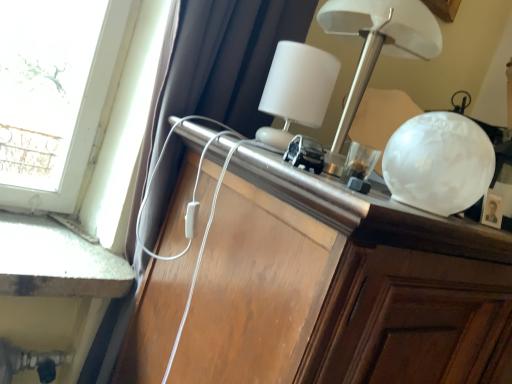
What are the coordinates of `white matte table lamp at upper center` in the screenshot? It's located at (297, 90).

At what (x,y) coordinates should I click in order to perform the action: click on white glossy lamp at upper center. Please return your answer as a coordinate pair (x, y). This screenshot has width=512, height=384. Looking at the image, I should click on (379, 41).

What are the coordinates of `white matte table lamp at upper center` in the screenshot? It's located at (297, 90).

From the image's perspective, relative to white glossy lamp at upper center, is wooden cabinet at center above or below?

wooden cabinet at center is situated lower than white glossy lamp at upper center in the image.

Choose the correct answer: Is wooden cabinet at center inside white glossy lamp at upper center or outside it?

The correct answer is: outside.

From a real-world perspective, which object stands above the other?

white glossy lamp at upper center is physically above.

Which point is more distant from viewer, (323,259) or (408,18)?

The point (408,18) is more distant.

Is point (380, 25) less distant than point (280, 90)?

Yes, it is in front of point (280, 90).

From the picture: Considering the sizes of white glossy lamp at upper center and white matte table lamp at upper center in the image, is white glossy lamp at upper center taller or shorter than white matte table lamp at upper center?

Considering their sizes, white glossy lamp at upper center has more height than white matte table lamp at upper center.

Is white glossy lamp at upper center not close to white matte table lamp at upper center?

No, white glossy lamp at upper center is in close proximity to white matte table lamp at upper center.

Which is closer to the camera, (291, 104) or (338, 137)?

Point (291, 104) is positioned closer to the camera compared to point (338, 137).

From the image's perspective, is white matte table lamp at upper center positioned above or below white glossy lamp at upper center?

From the image's perspective, white matte table lamp at upper center appears below white glossy lamp at upper center.

Can you confirm if white matte table lamp at upper center is taller than white glossy lamp at upper center?

No.

Can you confirm if white glossy lamp at upper center is shorter than wooden cabinet at center?

Yes, white glossy lamp at upper center is shorter than wooden cabinet at center.

From the image's perspective, which is above, white glossy lamp at upper center or wooden cabinet at center?

From the image's view, white glossy lamp at upper center is above.

Is white glossy lamp at upper center inside the boundaries of wooden cabinet at center, or outside?

white glossy lamp at upper center cannot be found inside wooden cabinet at center.

Image resolution: width=512 pixels, height=384 pixels. Find the location of `lamp above the wooden cabinet at center (from a real-world perspective)`. lamp above the wooden cabinet at center (from a real-world perspective) is located at coordinates (379, 41).

Considering their positions, is wooden cabinet at center located in front of or behind white matte table lamp at upper center?

wooden cabinet at center is positioned closer to the viewer than white matte table lamp at upper center.

Considering the relative positions of wooden cabinet at center and white matte table lamp at upper center in the image provided, is wooden cabinet at center to the left of white matte table lamp at upper center from the viewer's perspective?

Incorrect, wooden cabinet at center is not on the left side of white matte table lamp at upper center.

Is wooden cabinet at center positioned with its back to white matte table lamp at upper center?

That's not correct — wooden cabinet at center is not looking away from white matte table lamp at upper center.

Can you confirm if white matte table lamp at upper center is wider than wooden cabinet at center?

In fact, white matte table lamp at upper center might be narrower than wooden cabinet at center.

Can you see white matte table lamp at upper center touching wooden cabinet at center?

No, white matte table lamp at upper center is not with wooden cabinet at center.

Does white matte table lamp at upper center appear on the left side of wooden cabinet at center?

Yes.

Could you tell me if white matte table lamp at upper center is turned towards wooden cabinet at center?

No, white matte table lamp at upper center is not facing towards wooden cabinet at center.

Identify the location of cabinetry on the right of the white glossy lamp at upper center. (339, 286).

Locate an element on the screen. This screenshot has height=384, width=512. lamp that is in front of the white matte table lamp at upper center is located at coordinates (379, 41).

Looking at the image, which one is located closer to white matte table lamp at upper center, white glossy lamp at upper center or wooden cabinet at center?

The object closer to white matte table lamp at upper center is white glossy lamp at upper center.

Looking at the image, which one is located further to white matte table lamp at upper center, wooden cabinet at center or white glossy lamp at upper center?

The object further to white matte table lamp at upper center is wooden cabinet at center.

Looking at the image, which one is located closer to white glossy lamp at upper center, white matte table lamp at upper center or wooden cabinet at center?

white matte table lamp at upper center lies closer to white glossy lamp at upper center than the other object.

Considering their positions, is white glossy lamp at upper center positioned closer to wooden cabinet at center than white matte table lamp at upper center?

Based on the image, white matte table lamp at upper center appears to be nearer to wooden cabinet at center.

Based on their spatial positions, is white matte table lamp at upper center or white glossy lamp at upper center further from wooden cabinet at center?

white glossy lamp at upper center is positioned further to the anchor wooden cabinet at center.

Which object lies further to the anchor point white glossy lamp at upper center, wooden cabinet at center or white matte table lamp at upper center?

Based on the image, wooden cabinet at center appears to be further to white glossy lamp at upper center.

Locate an element on the screen. The height and width of the screenshot is (384, 512). table lamp between white glossy lamp at upper center and wooden cabinet at center vertically is located at coordinates (297, 90).